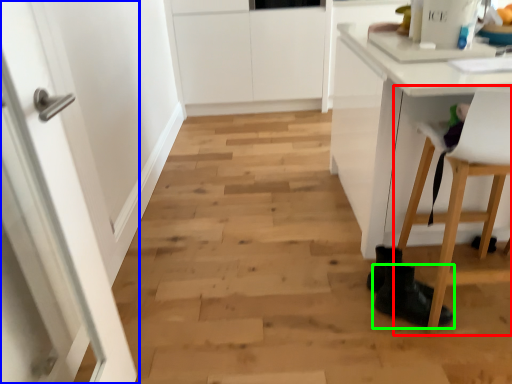
Question: Which is farther away from chair (highlighted by a red box)? door (highlighted by a blue box) or footwear (highlighted by a green box)?

Choices:
 (A) door
 (B) footwear

Answer: (A)